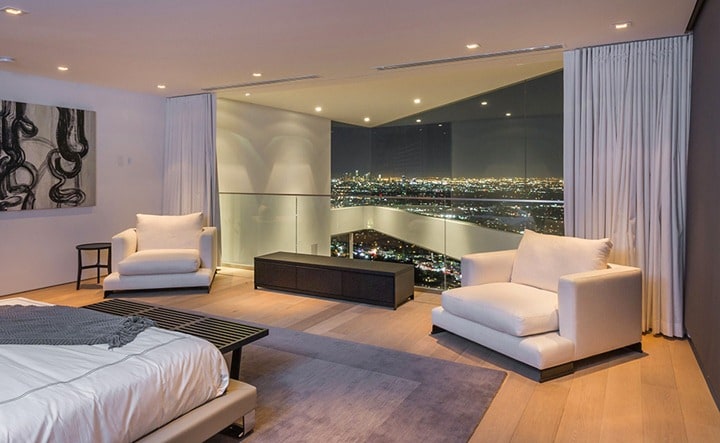
Find the location of a particular element. rug is located at coordinates (400, 384).